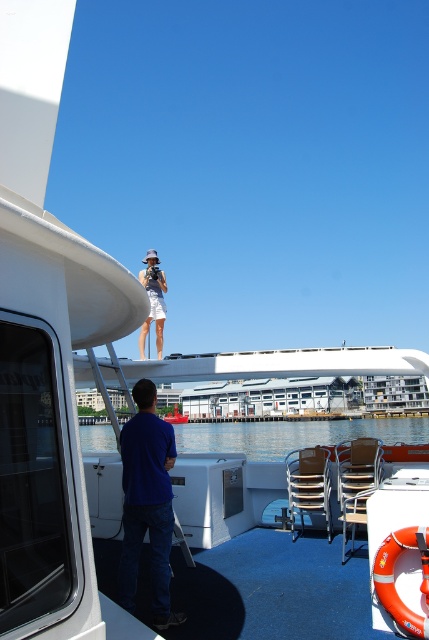
You are navigating a drone that needs to avoid obstacles on a boat. The drone must fly from the lifebuoy at lower right to the person in dark blue shirt and jeans at the edge of the boat. Is the matte white skirt at upper center in the direct flight path between these two points?

The matte white skirt at upper center is located at coordinates point (153, 301), so it is in the direct flight path between the lifebuoy at lower right and the person in dark blue shirt and jeans at the edge of the boat.

You are on a boat and see the matte white skirt at upper center and the light blue plastic boat at center. Which object is located to the right of the other?

The matte white skirt at upper center is positioned on the right side of light blue plastic boat at center.

You are on a boat and want to know how far the point at coordinates (x=133, y=417) is from where you are standing. Can you determine the distance?

The distance of point (x=133, y=417) from camera is 4.43 meters.